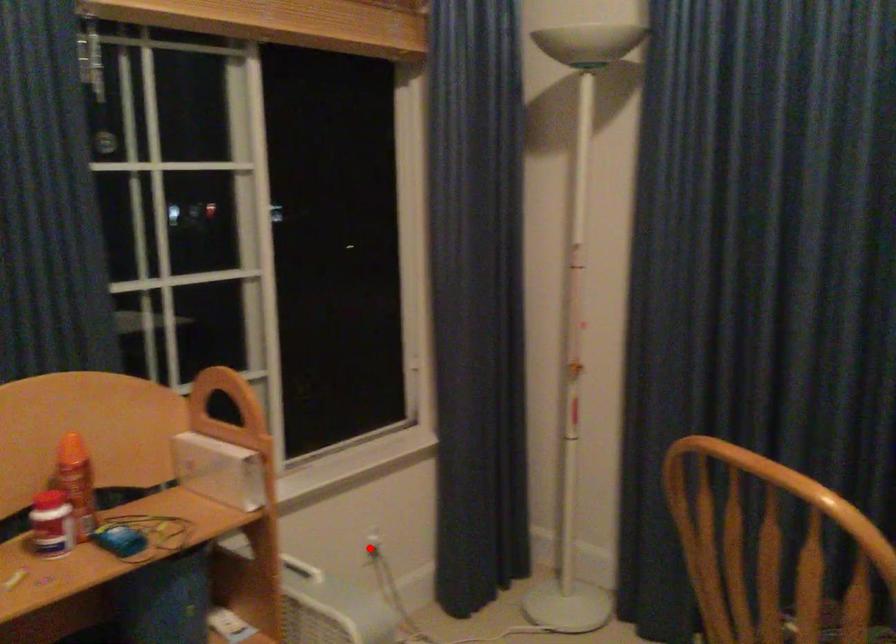
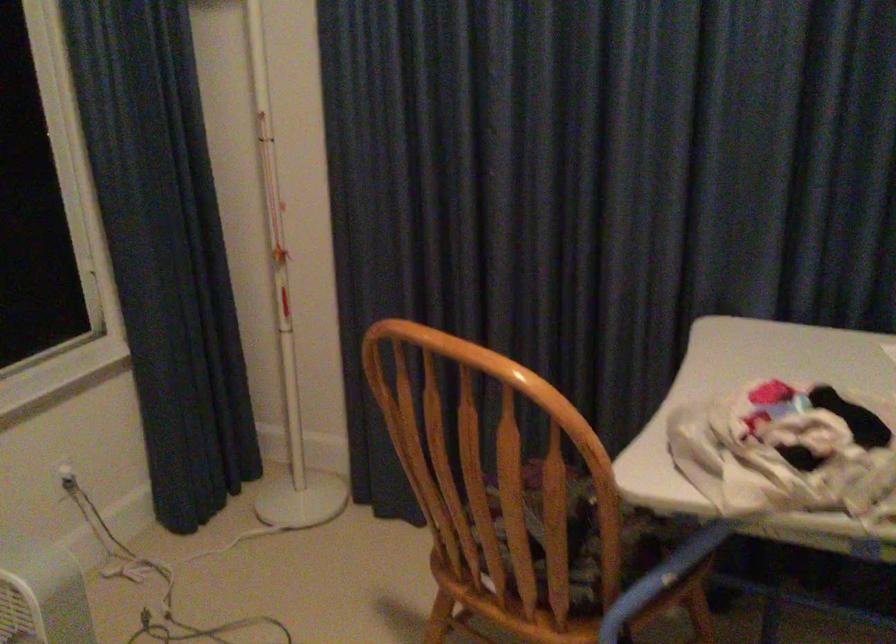
Locate, in the second image, the point that corresponds to the highlighted location in the first image.

(65, 478)